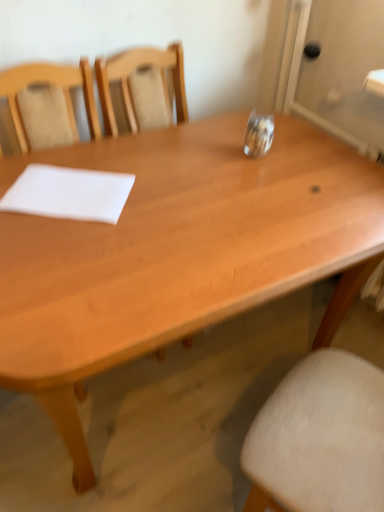
At what (x,y) coordinates should I click in order to perform the action: click on white paper at left. Please return your answer as a coordinate pair (x, y). This screenshot has height=512, width=384. Looking at the image, I should click on (69, 193).

Describe the element at coordinates (69, 193) in the screenshot. This screenshot has height=512, width=384. I see `white paper at left` at that location.

The image size is (384, 512). I want to click on white paper at left, so click(x=69, y=193).